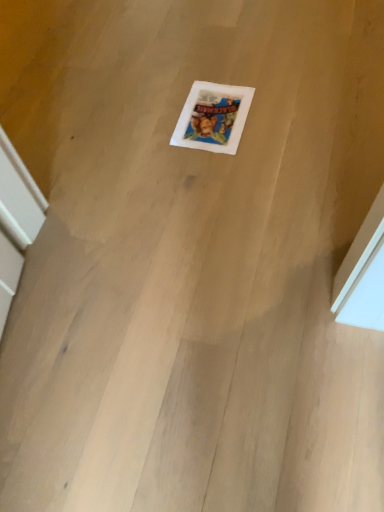
Where is `empty space that is ontop of white matte picture frame at center (from a real-world perspective)`? This screenshot has height=512, width=384. empty space that is ontop of white matte picture frame at center (from a real-world perspective) is located at coordinates (214, 111).